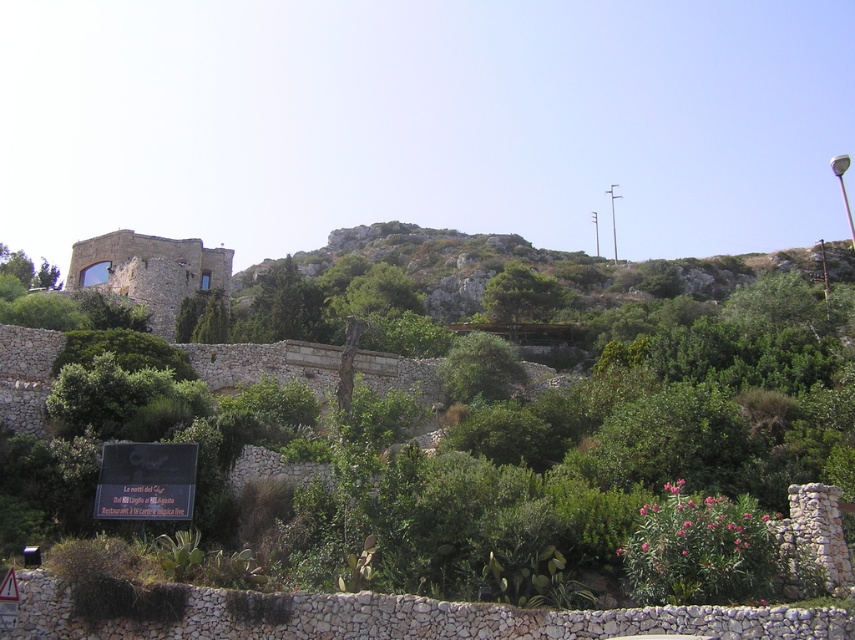
Between point (504, 312) and point (51, 268), which one is positioned behind?

Point (51, 268)

Which is in front, point (504, 317) or point (55, 282)?

Point (55, 282) is more forward.

Locate an element on the screen. This screenshot has width=855, height=640. green leafy tree at center is located at coordinates (523, 301).

Who is taller, rustic stone castle at center-left or black matte sign at lower left?

rustic stone castle at center-left

Does point (127, 243) come in front of point (181, 483)?

No, it is behind (181, 483).

Between point (154, 250) and point (145, 486), which one is positioned in front?

Point (145, 486)

Identify the location of rustic stone castle at center-left. The image size is (855, 640). (149, 272).

Is the position of rockymaterial/texturehillside at upper center more distant than that of black matte sign at lower left?

Yes, rockymaterial/texturehillside at upper center is further from the viewer.

Between point (724, 269) and point (122, 442), which one is positioned behind?

Positioned behind is point (724, 269).

The height and width of the screenshot is (640, 855). Identify the location of rockymaterial/texturehillside at upper center. (540, 266).

Locate an element on the screen. rockymaterial/texturehillside at upper center is located at coordinates (540, 266).